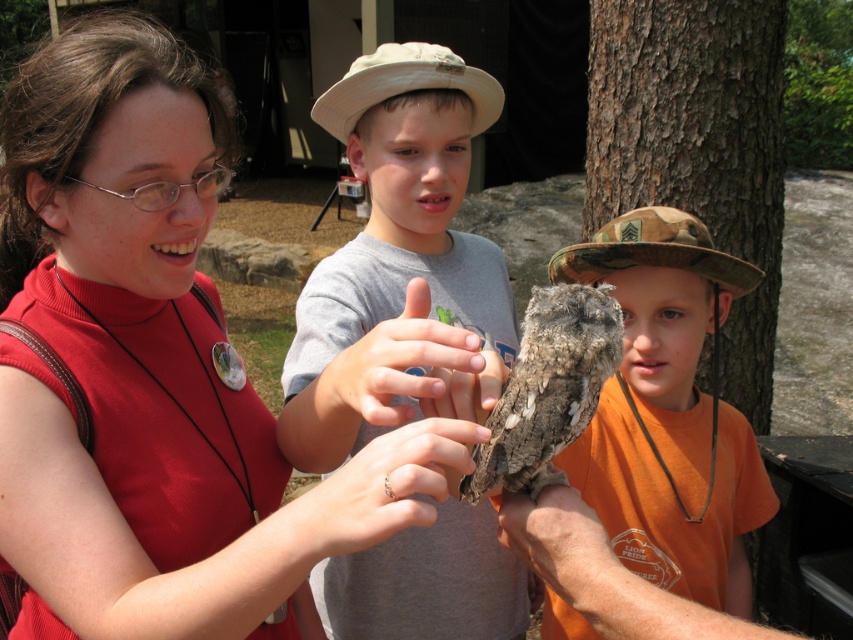
Question: Based on their relative distances, which object is farther from the matte skin hand at center?

Choices:
 (A) camouflage hat at center
 (B) smooth skin hand at center

Answer: (A)

Question: Which point is closer to the camera?

Choices:
 (A) (28, 378)
 (B) (730, 586)
 (C) (561, 385)

Answer: (C)

Question: Is matte skin hand at center to the right of smooth orange skin at lower center from the viewer's perspective?

Choices:
 (A) yes
 (B) no

Answer: (B)

Question: Does camouflage hat at center come behind matte skin hand at center?

Choices:
 (A) no
 (B) yes

Answer: (B)

Question: Among these objects, which one is nearest to the camera?

Choices:
 (A) smooth orange skin at lower center
 (B) matte skin hand at center
 (C) smooth skin hand at center
 (D) speckled brown owl at center

Answer: (B)

Question: Is camouflage hat at center closer to camera compared to smooth skin hand at center?

Choices:
 (A) yes
 (B) no

Answer: (B)